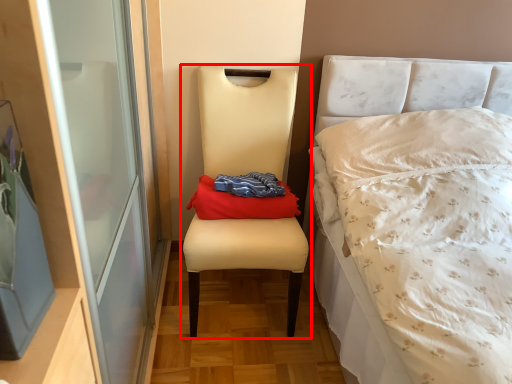
Question: Observing the image, what is the correct spatial positioning of chair (annotated by the red box) in reference to throw pillow?

Choices:
 (A) left
 (B) right

Answer: (A)